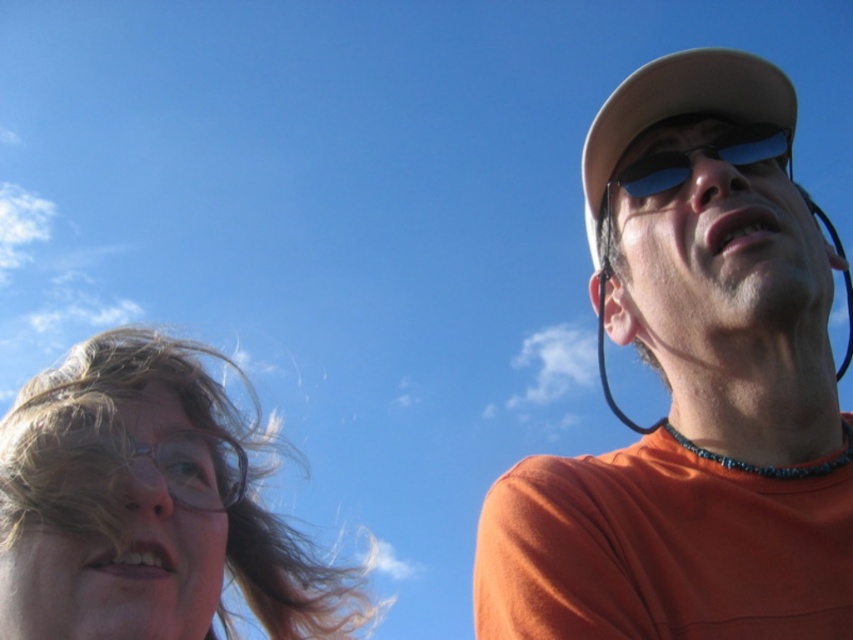
Question: Among these points, which one is farthest from the camera?

Choices:
 (A) (82, 636)
 (B) (743, 106)

Answer: (B)

Question: Among these points, which one is nearest to the camera?

Choices:
 (A) (233, 444)
 (B) (714, 144)
 (C) (735, 310)

Answer: (C)

Question: Does translucent plastic glasses at left have a smaller size compared to sunglasses at upper right?

Choices:
 (A) no
 (B) yes

Answer: (A)

Question: Can you confirm if orange matte shirt at right is smaller than sunglasses at upper right?

Choices:
 (A) yes
 (B) no

Answer: (B)

Question: Which point is closer to the camera taking this photo?

Choices:
 (A) (744, 147)
 (B) (172, 627)

Answer: (A)

Question: Does translucent plastic glasses at left have a lesser width compared to sunglasses at upper right?

Choices:
 (A) no
 (B) yes

Answer: (A)